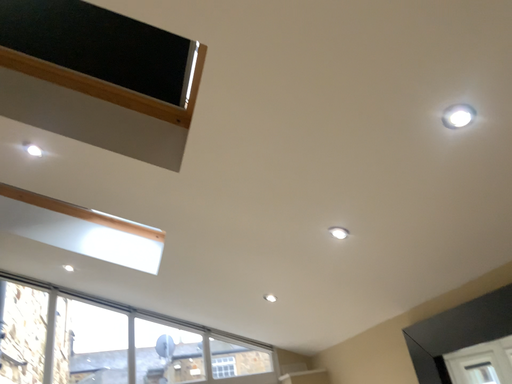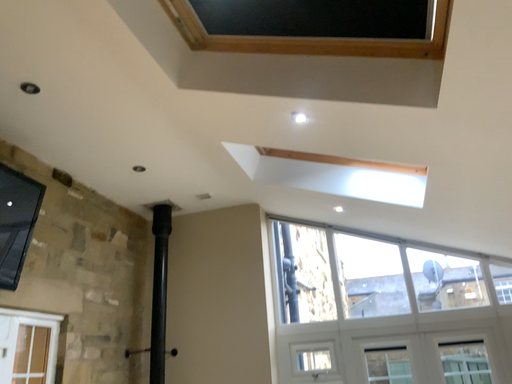
Question: How did the camera likely rotate when shooting the video?

Choices:
 (A) rotated left
 (B) rotated right

Answer: (A)